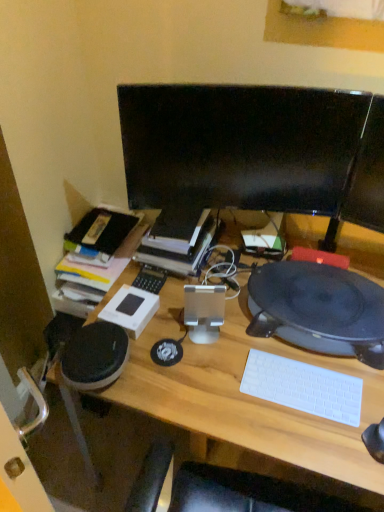
Image resolution: width=384 pixels, height=512 pixels. In order to click on free point to the right of white plastic keyboard at lower right in this screenshot , I will do `click(355, 380)`.